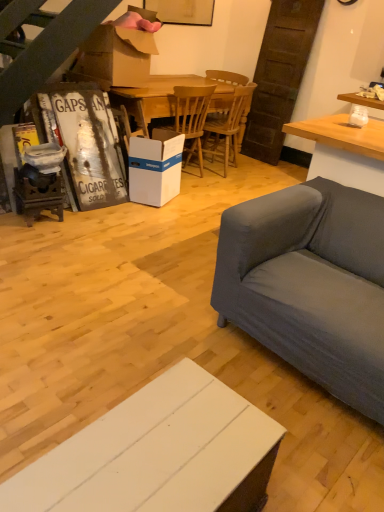
Question: Considering their positions, is white wood cabinet at lower center located in front of or behind wooden chair at center, which is the 2th chair in left-to-right order?

Choices:
 (A) behind
 (B) front

Answer: (B)

Question: Do you think white wood cabinet at lower center is within wooden chair at center, which is the 2th chair in left-to-right order, or outside of it?

Choices:
 (A) inside
 (B) outside

Answer: (B)

Question: Which is nearer to the brown cardboard box at upper center?

Choices:
 (A) white cardboard box at center
 (B) wooden chair at center, which is the 2th chair in left-to-right order
 (C) wooden at center, which is the second chair in right-to-left order
 (D) white wood cabinet at lower center
 (E) wooden table at center

Answer: (E)

Question: Estimate the real-world distances between objects in this image. Which object is closer to the wooden table at center?

Choices:
 (A) brown cardboard box at upper center
 (B) white cardboard box at center
 (C) white wood cabinet at lower center
 (D) wooden at center, which is the second chair in right-to-left order
 (E) wooden chair at center, which is the first chair from right to left

Answer: (D)